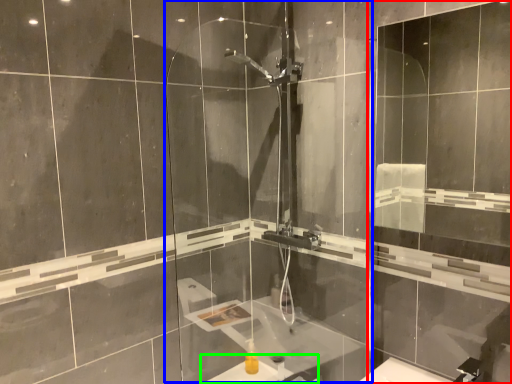
Question: Which object is positioned farthest from screen door (highlighted by a red box)? Select from screen door (highlighted by a blue box) and sink (highlighted by a green box).

Choices:
 (A) screen door
 (B) sink

Answer: (B)